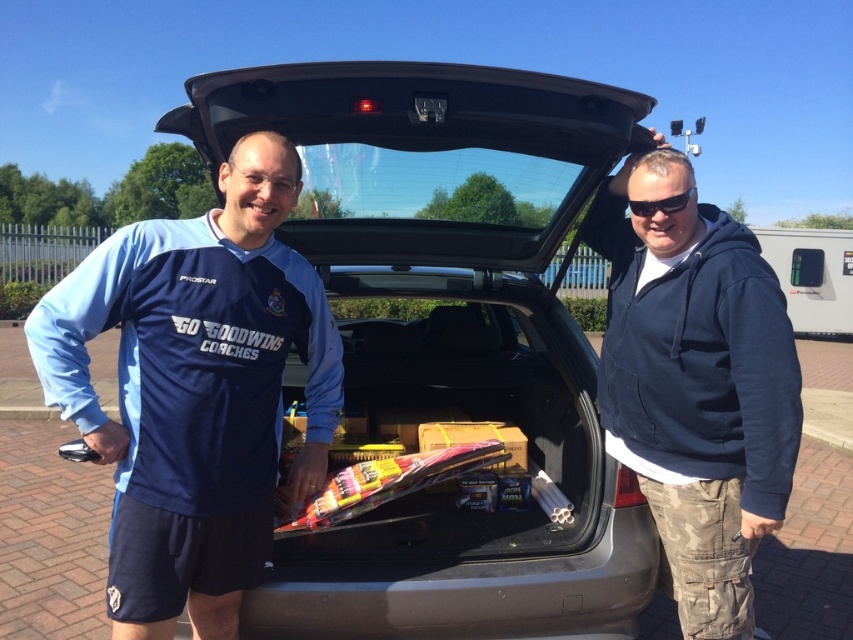
Is matte black car at center shorter than blue jersey at center?

In fact, matte black car at center may be taller than blue jersey at center.

Does matte black car at center appear under blue jersey at center?

Yes, matte black car at center is below blue jersey at center.

I want to click on matte black car at center, so click(x=447, y=342).

From the picture: Is the position of blue jersey at center less distant than that of black plastic goggles at upper center?

Yes, blue jersey at center is in front of black plastic goggles at upper center.

Is blue jersey at center smaller than black plastic goggles at upper center?

Answer: Incorrect, blue jersey at center is not smaller in size than black plastic goggles at upper center.

Which is in front, point (286, 160) or point (627, 202)?

Point (286, 160) is in front.

This screenshot has width=853, height=640. Find the location of `blue jersey at center`. blue jersey at center is located at coordinates (196, 392).

Is blue jersey at center positioned before navy blue hoodie at center?

Yes, blue jersey at center is closer to the viewer.

What do you see at coordinates (196, 392) in the screenshot? Image resolution: width=853 pixels, height=640 pixels. I see `blue jersey at center` at bounding box center [196, 392].

This screenshot has width=853, height=640. Identify the location of blue jersey at center. (196, 392).